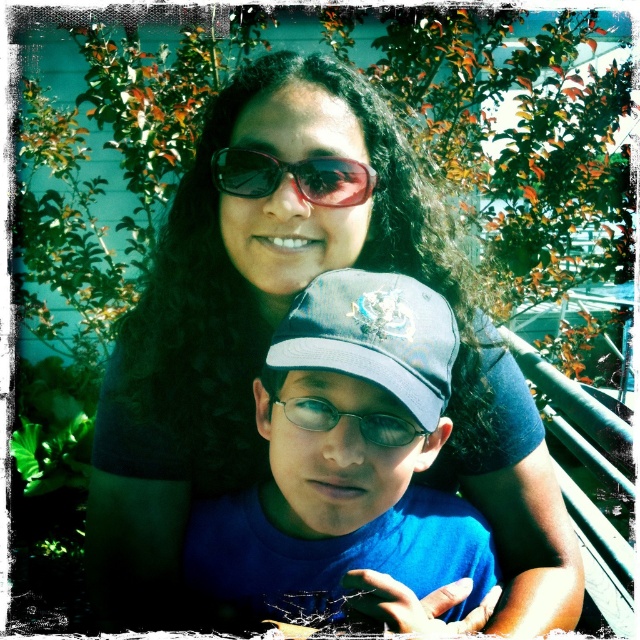
You are a photographer adjusting your camera settings. You notice the matte black sunglasses at upper center and the clear plastic glasses at center in the scene. Which object is positioned closer to you?

The matte black sunglasses at upper center is closer to the viewer than the clear plastic glasses at center.

You are a photographer trying to capture a closeup of the clear plastic glasses at center without the matte black sunglasses at upper center appearing in the frame. Is it possible to do so given their positions?

The matte black sunglasses at upper center is much taller than the clear plastic glasses at center, so it would likely block the view of the clear plastic glasses at center. Therefore, capturing a closeup of the clear plastic glasses at center without the matte black sunglasses at upper center appearing in the frame might not be possible.